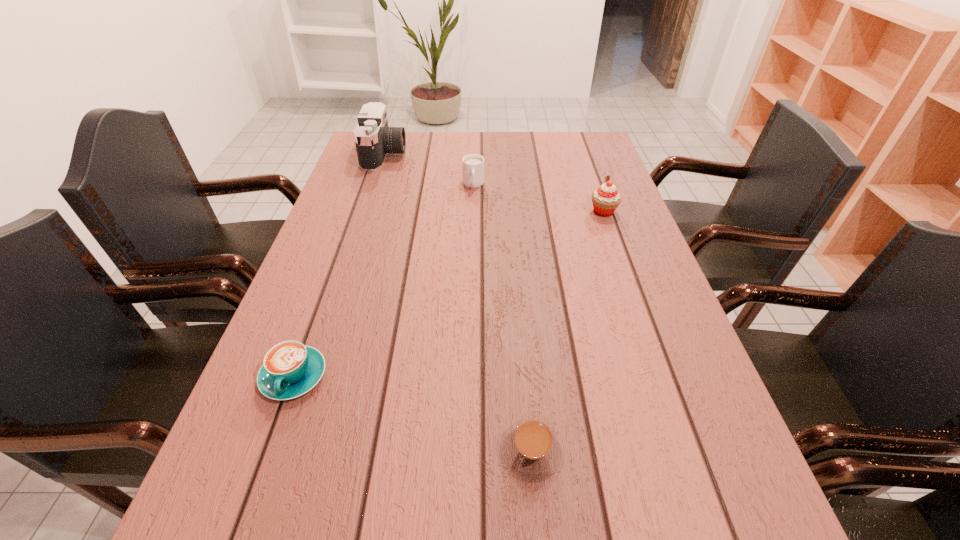
Locate an element on the screen. Image resolution: width=960 pixels, height=540 pixels. free space between the farthest object and the rightmost object is located at coordinates (494, 183).

Where is `free spot between the rightmost object and the third object from right to left`? free spot between the rightmost object and the third object from right to left is located at coordinates (539, 198).

You are a GUI agent. You are given a task and a screenshot of the screen. Output one action in this format:
    pyautogui.click(x=<x>, y=<y>)
    Task: Click on the unoccupied area between the nearest object and the second farthest object
    
    Given the screenshot: What is the action you would take?
    pyautogui.click(x=503, y=318)

I want to click on vacant space that is in between the nearest object and the second farthest cappuccino, so click(x=413, y=414).

Where is `object that stands as the fourth closest to the rightmost cappuccino`? Image resolution: width=960 pixels, height=540 pixels. object that stands as the fourth closest to the rightmost cappuccino is located at coordinates (374, 139).

Locate which object is the third closest to the nearest cappuccino. Please provide its 2D coordinates. Your answer should be formatted as a tuple, i.e. [(x, y)], where the tuple contains the x and y coordinates of a point satisfying the conditions above.

[(473, 164)]

This screenshot has width=960, height=540. Identify the location of cappuccino that is the second closest one to the fourth shortest object. (531, 449).

Identify which cappuccino is the closest to the leftmost cappuccino. Please provide its 2D coordinates. Your answer should be formatted as a tuple, i.e. [(x, y)], where the tuple contains the x and y coordinates of a point satisfying the conditions above.

[(531, 449)]

The width and height of the screenshot is (960, 540). What are the coordinates of `vacant region that satisfies the following two spatial constraints: 1. on the front-facing side of the camera; 2. with the handle on the right side of the fourth farthest object` in the screenshot? It's located at (312, 376).

Where is `blank space that satisfies the following two spatial constraints: 1. on the side with the handle of the fourth shortest object; 2. on the right side of the fourth nearest object`? Image resolution: width=960 pixels, height=540 pixels. blank space that satisfies the following two spatial constraints: 1. on the side with the handle of the fourth shortest object; 2. on the right side of the fourth nearest object is located at coordinates (473, 212).